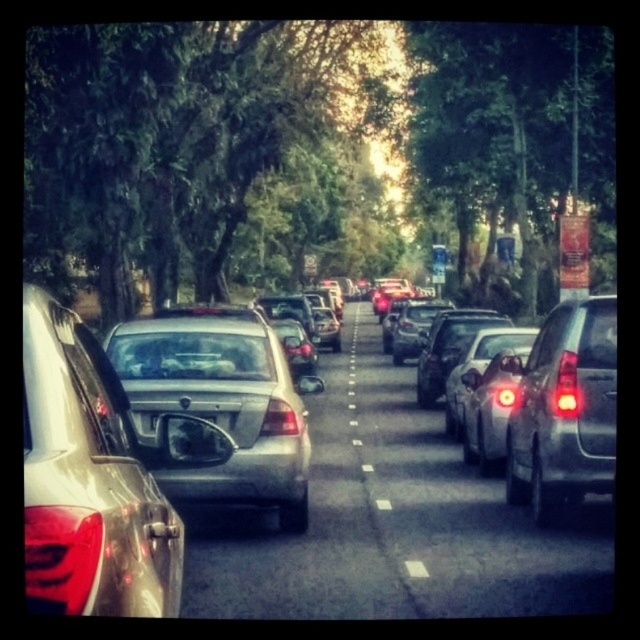
Is satin gold sedan at left taller than white dotted lines at center?

No.

Can you confirm if satin gold sedan at left is thinner than white dotted lines at center?

Incorrect, satin gold sedan at left's width is not less than white dotted lines at center's.

Which is in front, point (33, 364) or point (349, 413)?

Positioned in front is point (33, 364).

This screenshot has height=640, width=640. I want to click on satin gold sedan at left, so click(x=88, y=481).

Who is lower down, white dotted lines at center or black matte license plate at center?

white dotted lines at center

Which is above, white dotted lines at center or black matte license plate at center?

black matte license plate at center is higher up.

Is point (376, 538) less distant than point (138, 416)?

That is False.

Locate an element on the screen. This screenshot has width=640, height=640. white dotted lines at center is located at coordinates (371, 476).

Is satin gold sedan at left thinner than satin silver sedan at center?

Yes, satin gold sedan at left is thinner than satin silver sedan at center.

Does satin gold sedan at left appear under satin silver sedan at center?

Incorrect, satin gold sedan at left is not positioned below satin silver sedan at center.

Is point (112, 593) farther from camera compared to point (269, 344)?

No.

Identify the location of satin gold sedan at left. The height and width of the screenshot is (640, 640). (88, 481).